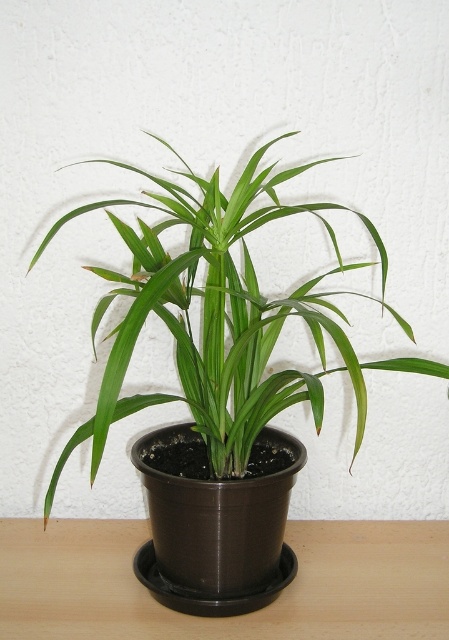
Between green matte plant at center and brown wooden table at center, which one has less height?

brown wooden table at center

Is green matte plant at center positioned behind brown wooden table at center?

That is False.

Locate an element on the screen. green matte plant at center is located at coordinates (221, 316).